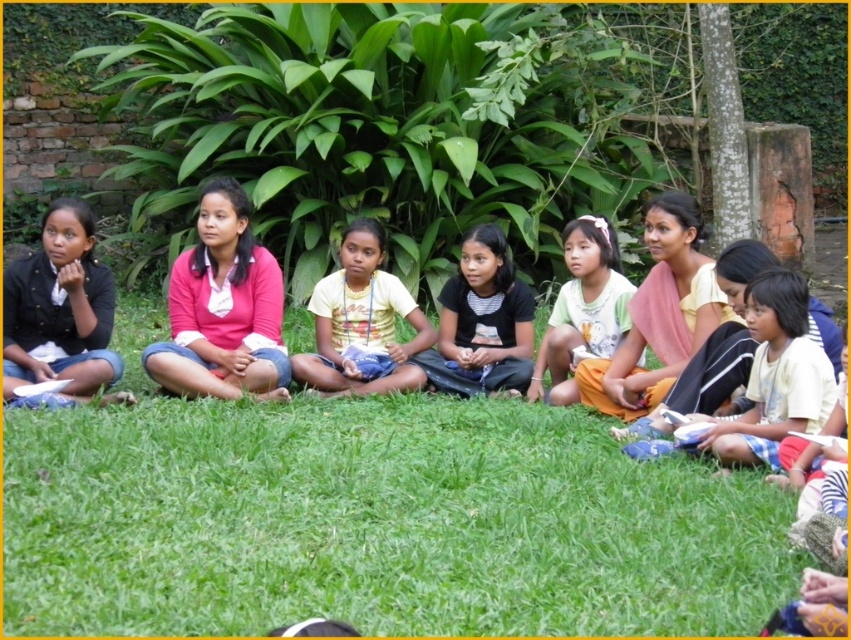
You are a photographer trying to capture a clear shot of the children in the park. You notice the green grass at center and the white cotton shirt at center. Which object is closer to the camera?

The green grass at center is in front of the white cotton shirt at center, so it is closer to the camera.

You are a photographer setting up for a group photo of the children in the park. You need to ensure that the pink cotton shirt at center and the black matte jacket at left are both visible in the frame. Based on their positions, which child should you adjust to avoid being blocked by the other?

The pink cotton shirt at center is taller than the black matte jacket at left. To avoid blocking, you should lower the height of the pink cotton shirt at center or move the black matte jacket at left slightly forward so that the shorter black matte jacket at left is not obscured by the taller pink cotton shirt at center.